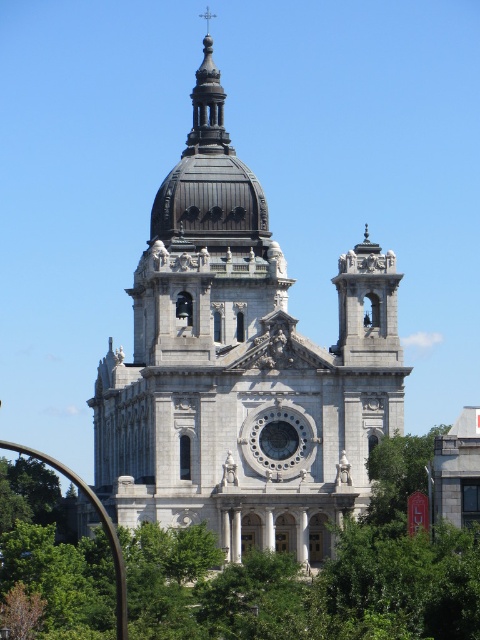
You are standing in front of the historic church and want to take a photo that includes both the white stone church at center and the green leafy tree at center. Based on their positions, which object should you position on the left side of your photo?

The white stone church at center should be positioned on the left side of your photo because it is to the left of the green leafy tree at center according to the description.

You are standing at the entrance of the historic church and see two points marked on the facade. The first point is at coordinates point (172, 234) and the second is at point (384, 497). Which point is closer to the entrance?

Point (172, 234) is behind point (384, 497), so the point closer to the entrance is point (384, 497).

You are standing in front of the white stone church at center and want to take a photo that includes both it and the green leafy tree at lower right. Which object should you focus on first to ensure both are in frame?

You should focus on the white stone church at center first because it is taller than the green leafy tree at lower right, so you can adjust the camera angle to include both by centering the church and framing the tree in the lower right corner.